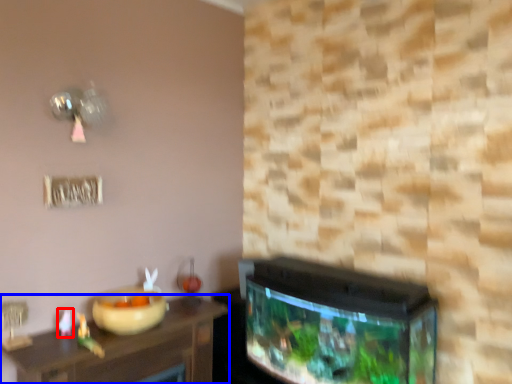
Question: Which point is closer to the camera, toy (highlighted by a red box) or table (highlighted by a blue box)?

Choices:
 (A) toy
 (B) table

Answer: (B)